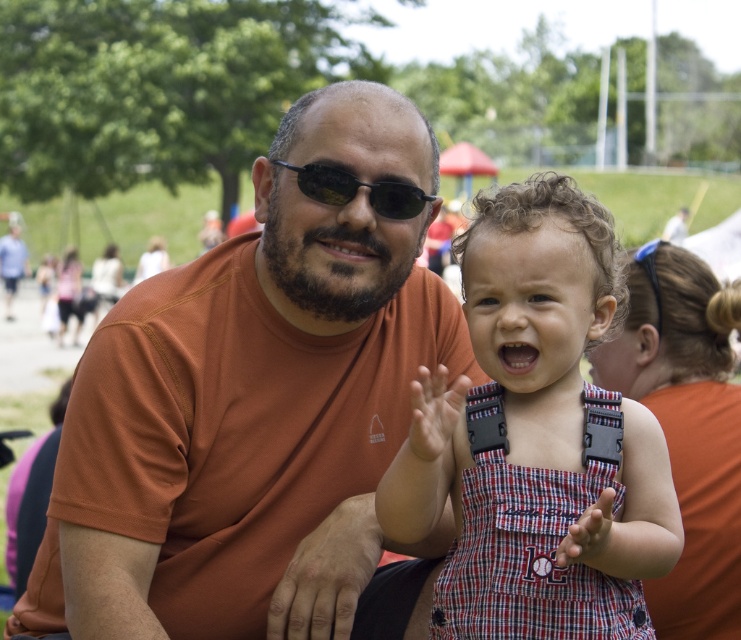
Question: Is plaid fabric overalls at center to the right of black plastic sunglasses at center from the viewer's perspective?

Choices:
 (A) no
 (B) yes

Answer: (B)

Question: Which of the following is the farthest from the observer?

Choices:
 (A) (558, 410)
 (B) (179, 593)

Answer: (B)

Question: In this image, where is plaid fabric overalls at center located relative to black plastic sunglasses at center?

Choices:
 (A) below
 (B) above

Answer: (A)

Question: Which point is farther to the camera?

Choices:
 (A) orange t-shirt at center
 (B) black plastic sunglasses at center
 (C) plaid fabric overalls at center

Answer: (B)

Question: Which point appears closest to the camera in this image?

Choices:
 (A) (576, 301)
 (B) (305, 182)

Answer: (A)

Question: Is plaid fabric overalls at center below black plastic sunglasses at center?

Choices:
 (A) yes
 (B) no

Answer: (A)